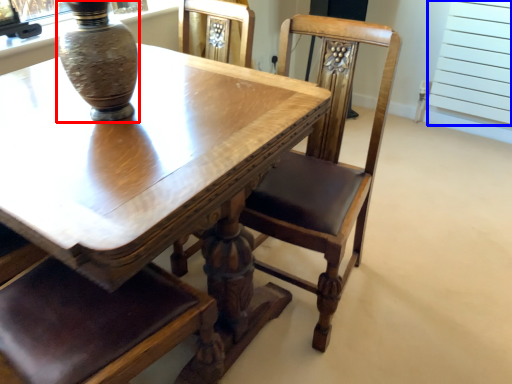
Question: Among these objects, which one is farthest to the camera, vase (highlighted by a red box) or screen door (highlighted by a blue box)?

Choices:
 (A) vase
 (B) screen door

Answer: (B)